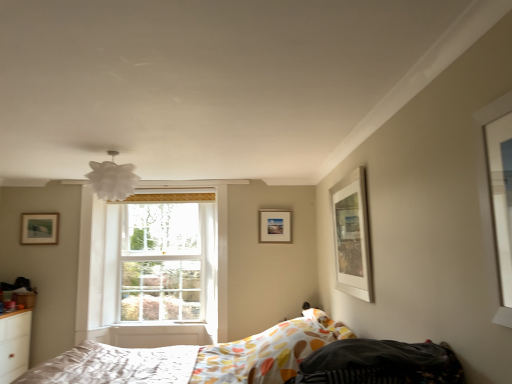
Question: Looking at their shapes, would you say white fabric mattress at lower left, the second mattress viewed from the front, is wider or thinner than patterned fabric mattress at lower right, which is the second mattress from back to front?

Choices:
 (A) wide
 (B) thin

Answer: (A)

Question: Is white fabric mattress at lower left, arranged as the first mattress when ordered from the bottom, to the left or to the right of patterned fabric mattress at lower right, which is the first mattress in top-to-bottom order, in the image?

Choices:
 (A) right
 (B) left

Answer: (B)

Question: Estimate the real-world distances between objects in this image. Which object is farther from the wooden picture frame at upper left, which is the 3th picture frame in right-to-left order?

Choices:
 (A) clear glass window at center
 (B) white paper lampshade at upper center
 (C) wooden picture frame at center, the second picture frame in the right-to-left sequence
 (D) white fabric mattress at lower left, the first mattress in the back-to-front sequence
 (E) patterned fabric mattress at lower right, which is the first mattress in top-to-bottom order

Answer: (E)

Question: Which object is the farthest from the wooden picture frame at center, positioned as the 2th picture frame in left-to-right order?

Choices:
 (A) white paper lampshade at upper center
 (B) wooden picture frame at upper left, which is the 3th picture frame in right-to-left order
 (C) patterned fabric bed at lower center
 (D) patterned fabric mattress at lower right, which is the second mattress from back to front
 (E) white matte picture frame at upper right, which appears as the 3th picture frame when viewed from the back

Answer: (D)